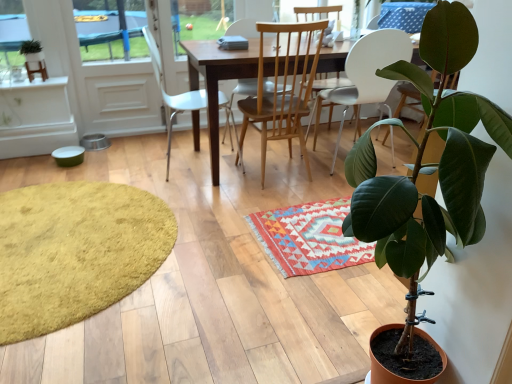
Where is `vacant region under white plastic chair at center, placed as the first chair when sorted from left to right (from a real-world perspective)`? The width and height of the screenshot is (512, 384). vacant region under white plastic chair at center, placed as the first chair when sorted from left to right (from a real-world perspective) is located at coordinates (181, 159).